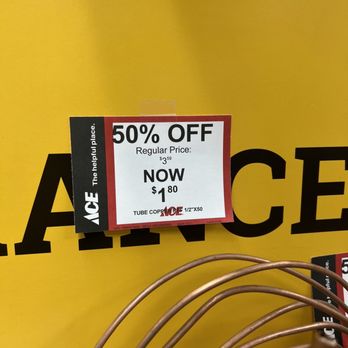
Where is `gold frame`? gold frame is located at coordinates (318, 341).